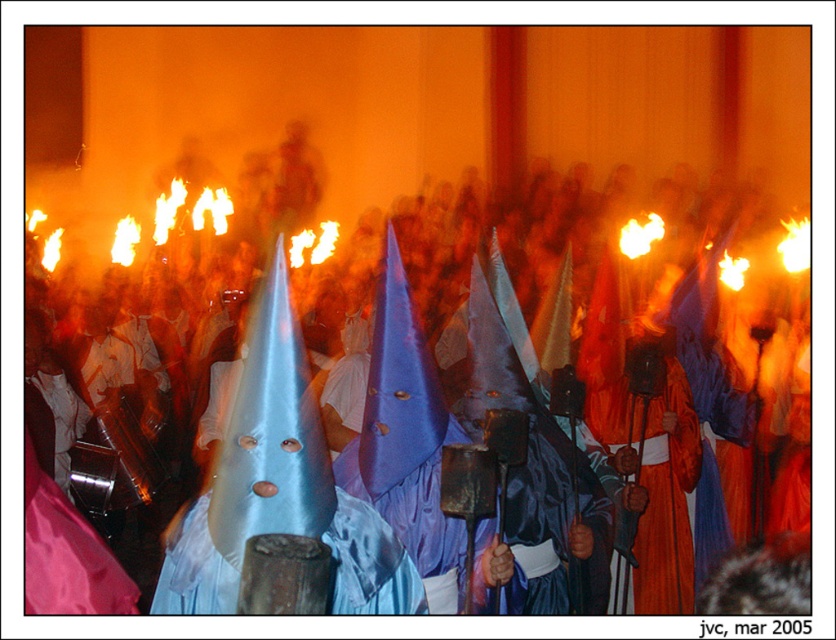
You are an anthropologist observing this cultural event. You notice the satin blue cone at center and the orange satin robe at center. Which object is positioned lower in the image?

The satin blue cone at center is located below orange satin robe at center, so it is positioned lower in the image.

You are an observer in the scene. You notice the satin blue cone at center and the orange satin robe at center. Which object is shorter in height?

The satin blue cone at center is shorter in height compared to the orange satin robe at center.